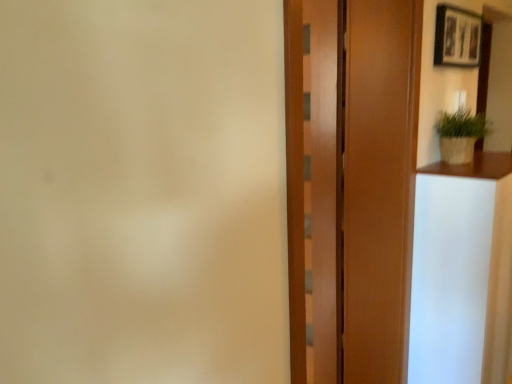
Question: In terms of height, does white glossy vanity at right look taller or shorter compared to wooden barn door at center?

Choices:
 (A) short
 (B) tall

Answer: (A)

Question: Is point (500, 253) closer or farther from the camera than point (330, 221)?

Choices:
 (A) farther
 (B) closer

Answer: (B)

Question: Estimate the real-world distances between objects in this image. Which object is closer to the wooden door at center?

Choices:
 (A) white glossy vanity at right
 (B) green woven basket at upper right
 (C) wooden barn door at center
 (D) wooden picture frame at upper right

Answer: (C)

Question: Considering the real-world distances, which object is closest to the wooden door at center?

Choices:
 (A) wooden barn door at center
 (B) green woven basket at upper right
 (C) white glossy vanity at right
 (D) wooden picture frame at upper right

Answer: (A)